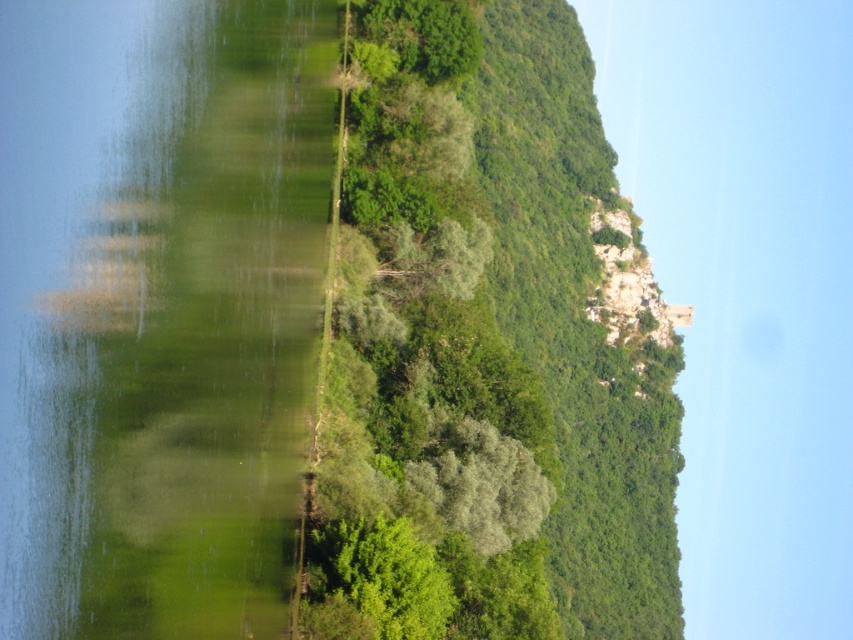
You are standing in the serene landscape and want to place a small statue. You have two options for placement based on the coordinates given. Which coordinate point, point (219,458) or point (395,182), is closer to where you are standing?

Point (219,458) is closer to the viewer than point (395,182), so the statue should be placed there if you want it closer to your current position.